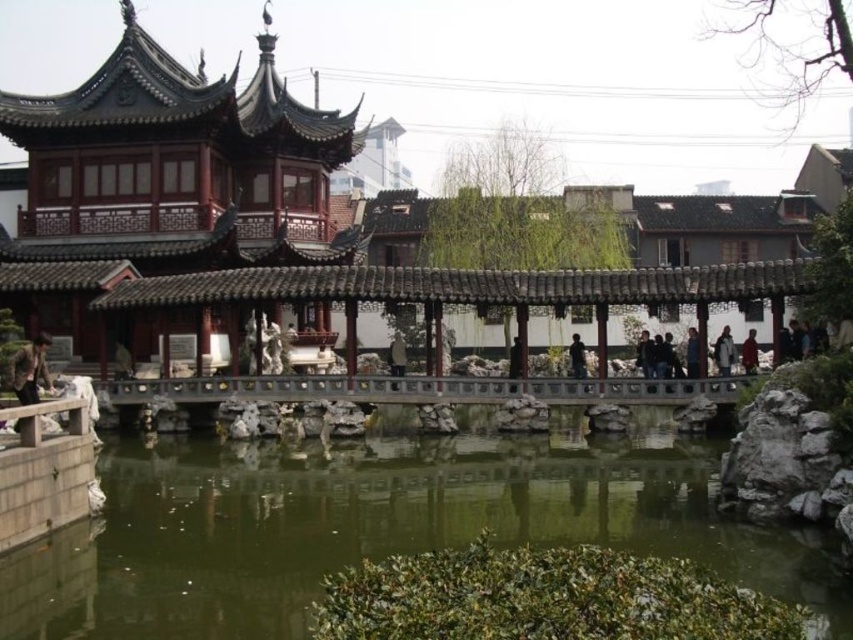
You are a photographer planning to capture the brown leather jacket at lower left and the black matte person at center in the same frame. Which object is wider?

The brown leather jacket at lower left is wider than the black matte person at center.